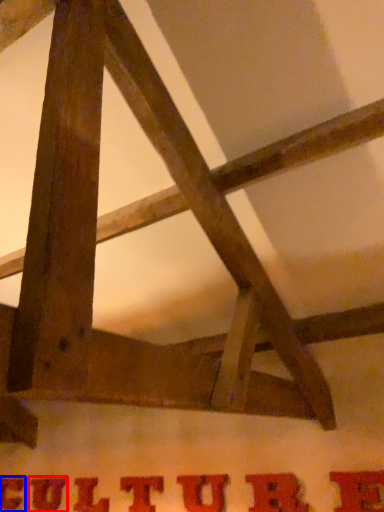
Question: Among these objects, which one is farthest to the camera, letter (highlighted by a red box) or letter (highlighted by a blue box)?

Choices:
 (A) letter
 (B) letter

Answer: (B)